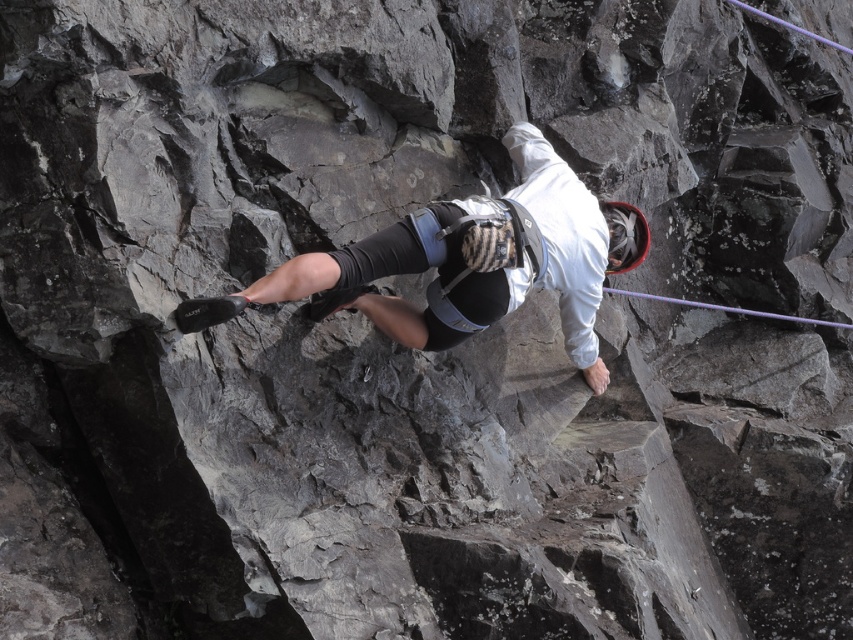
You are a safety inspector evaluating the climbing setup. The safety guideline states that the helmet must be at least 36 inches away from the rope to prevent entanglement. Based on the image, is the current distance between the white fabric helmet at center and the purple synthetic rope at center compliant with the safety guideline?

The white fabric helmet at center and the purple synthetic rope at center are 34.28 inches apart, which is less than the required 36 inches. Therefore, the current setup does not comply with the safety guideline.

You are a photographer trying to capture the climber in the image. The climber is wearing a white fabric helmet at center. To ensure the helmet is in focus, where should you aim the camera? Please provide coordinates in the format of a point like this example format of point in the image coordinate system. The coordinate system has the origin at the bottom left corner of the image, with the x and y axes increasing to the right and up respectively.

The white fabric helmet at center is located at point coordinates of 0.411 in the x direction and 0.549 in the y direction. Therefore, you should aim the camera at point coordinates of approximately 0.411 in the x direction and 0.549 in the y direction to ensure the helmet is in focus.